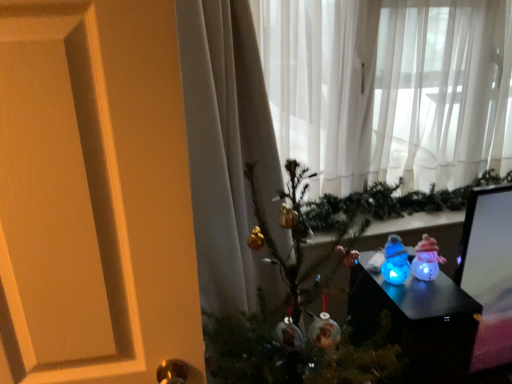
Question: From a real-world perspective, does blue translucent snowman at center, which is counted as the 2th toy, starting from the right, sit lower than sheer white curtain at upper center?

Choices:
 (A) yes
 (B) no

Answer: (A)

Question: From the image's perspective, is blue translucent snowman at center, which is counted as the 2th toy, starting from the right, above sheer white curtain at upper center?

Choices:
 (A) no
 (B) yes

Answer: (A)

Question: Is blue translucent snowman at center, the first toy from the left, positioned before sheer white curtain at upper center?

Choices:
 (A) yes
 (B) no

Answer: (A)

Question: Is blue translucent snowman at center, which is counted as the 2th toy, starting from the right, thinner than sheer white curtain at upper center?

Choices:
 (A) no
 (B) yes

Answer: (B)

Question: Is blue translucent snowman at center, the first toy from the left, shorter than sheer white curtain at upper center?

Choices:
 (A) yes
 (B) no

Answer: (A)

Question: Is blue translucent snowman at center, the first toy from the left, placed right next to sheer white curtain at upper center?

Choices:
 (A) no
 (B) yes

Answer: (A)

Question: Is translucent plastic snowman at center-right, marked as the 1th toy in a right-to-left arrangement, positioned in front of blue translucent snowman at center, the first toy from the left?

Choices:
 (A) yes
 (B) no

Answer: (B)

Question: Is translucent plastic snowman at center-right, marked as the 1th toy in a right-to-left arrangement, behind blue translucent snowman at center, which is counted as the 2th toy, starting from the right?

Choices:
 (A) yes
 (B) no

Answer: (A)

Question: Can you confirm if translucent plastic snowman at center-right, the 2th toy viewed from the left, is positioned to the right of blue translucent snowman at center, the first toy from the left?

Choices:
 (A) no
 (B) yes

Answer: (B)

Question: From a real-world perspective, does translucent plastic snowman at center-right, the 2th toy viewed from the left, sit lower than blue translucent snowman at center, the first toy from the left?

Choices:
 (A) no
 (B) yes

Answer: (B)

Question: Considering the relative sizes of translucent plastic snowman at center-right, the 2th toy viewed from the left, and blue translucent snowman at center, the first toy from the left, in the image provided, is translucent plastic snowman at center-right, the 2th toy viewed from the left, bigger than blue translucent snowman at center, the first toy from the left,?

Choices:
 (A) no
 (B) yes

Answer: (B)

Question: From the image's perspective, is translucent plastic snowman at center-right, the 2th toy viewed from the left, above blue translucent snowman at center, the first toy from the left?

Choices:
 (A) yes
 (B) no

Answer: (B)

Question: Considering the relative sizes of metallic gold ornaments at center and blue translucent snowman at center, which is counted as the 2th toy, starting from the right, in the image provided, is metallic gold ornaments at center wider than blue translucent snowman at center, which is counted as the 2th toy, starting from the right,?

Choices:
 (A) yes
 (B) no

Answer: (A)